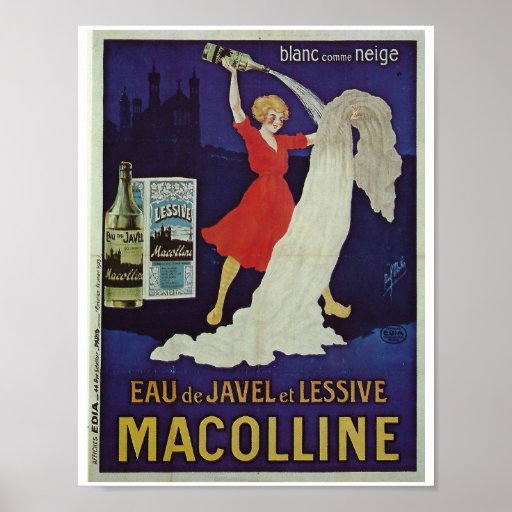
Find the location of `frame`. frame is located at coordinates (85, 244).